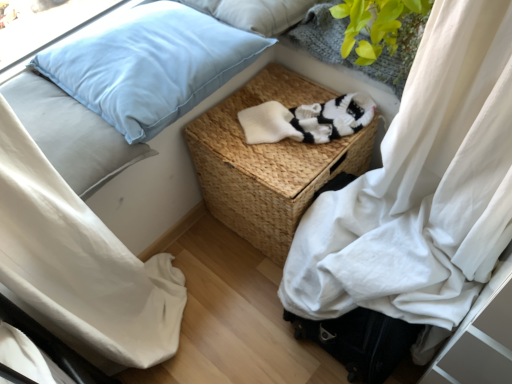
Locate an element on the screen. The image size is (512, 384). light blue fabric pillow at upper left, the 1th pillow from the top is located at coordinates (255, 13).

Describe the element at coordinates (255, 13) in the screenshot. I see `light blue fabric pillow at upper left, the 1th pillow from the top` at that location.

How much space does light blue fabric pillow at upper left, positioned as the second pillow in top-to-bottom order, occupy horizontally?

It is 19.73 inches.

Measure the distance between green knitted plant at upper right and camera.

The distance of green knitted plant at upper right from camera is 35.24 inches.

This screenshot has width=512, height=384. Describe the element at coordinates (268, 162) in the screenshot. I see `woven brown basket at center` at that location.

At what (x,y) coordinates should I click in order to perform the action: click on light blue fabric pillow at upper left, the third pillow from the bottom. Please return your answer as a coordinate pair (x, y). This screenshot has height=384, width=512. Looking at the image, I should click on (255, 13).

Based on the photo, considering the positions of objects light blue fabric pillow at upper left, acting as the 1th pillow starting from the bottom, and light blue fabric pillow at upper left, the 1th pillow from the top, in the image provided, who is more to the right, light blue fabric pillow at upper left, acting as the 1th pillow starting from the bottom, or light blue fabric pillow at upper left, the 1th pillow from the top,?

From the viewer's perspective, light blue fabric pillow at upper left, the 1th pillow from the top, appears more on the right side.

Is light blue fabric pillow at upper left, acting as the 1th pillow starting from the bottom, closer to camera compared to light blue fabric pillow at upper left, the 1th pillow from the top?

Yes.

Is light blue fabric pillow at upper left, the third pillow from the bottom, surrounded by light blue fabric pillow at upper left, which ranks as the third pillow in top-to-bottom order?

No, light blue fabric pillow at upper left, the third pillow from the bottom, is not inside light blue fabric pillow at upper left, which ranks as the third pillow in top-to-bottom order.

How different are the orientations of light blue fabric pillow at upper left, positioned as the second pillow in top-to-bottom order, and green knitted plant at upper right in degrees?

85.3 degrees separate the facing orientations of light blue fabric pillow at upper left, positioned as the second pillow in top-to-bottom order, and green knitted plant at upper right.

From the picture: Between light blue fabric pillow at upper left, which is the second pillow from bottom to top, and green knitted plant at upper right, which one has smaller width?

green knitted plant at upper right is thinner.

From the image's perspective, would you say light blue fabric pillow at upper left, positioned as the second pillow in top-to-bottom order, is positioned over green knitted plant at upper right?

No, from the image's perspective, light blue fabric pillow at upper left, positioned as the second pillow in top-to-bottom order, is not above green knitted plant at upper right.

Is light blue fabric pillow at upper left, which is the second pillow from bottom to top, bigger or smaller than green knitted plant at upper right?

light blue fabric pillow at upper left, which is the second pillow from bottom to top, is bigger than green knitted plant at upper right.

Is woven brown basket at center not close to white knitted socks at center?

woven brown basket at center is near white knitted socks at center, not far away.

Is woven brown basket at center bigger than white knitted socks at center?

Yes.

Is woven brown basket at center facing towards white knitted socks at center?

No, woven brown basket at center is not turned towards white knitted socks at center.

Considering the relative positions of woven brown basket at center and white knitted socks at center in the image provided, is woven brown basket at center to the left or to the right of white knitted socks at center?

Based on their positions, woven brown basket at center is located to the left of white knitted socks at center.

Does light blue fabric pillow at upper left, which is the second pillow from bottom to top, have a lesser height compared to woven brown basket at center?

Yes, light blue fabric pillow at upper left, which is the second pillow from bottom to top, is shorter than woven brown basket at center.

From the image's perspective, is light blue fabric pillow at upper left, which is the second pillow from bottom to top, located above or below woven brown basket at center?

From the image's perspective, light blue fabric pillow at upper left, which is the second pillow from bottom to top, appears above woven brown basket at center.

Where is `furniture on the right of light blue fabric pillow at upper left, positioned as the second pillow in top-to-bottom order`? furniture on the right of light blue fabric pillow at upper left, positioned as the second pillow in top-to-bottom order is located at coordinates (268, 162).

Find the location of `pillow that is the 3rd one when counting leftward from the green knitted plant at upper right`. pillow that is the 3rd one when counting leftward from the green knitted plant at upper right is located at coordinates (71, 133).

Considering the points (345, 55) and (78, 174), which point is in front, point (345, 55) or point (78, 174)?

Positioned in front is point (78, 174).

Is green knitted plant at upper right surrounding light blue fabric pillow at upper left, acting as the 1th pillow starting from the bottom?

No, light blue fabric pillow at upper left, acting as the 1th pillow starting from the bottom, is not inside green knitted plant at upper right.

Is light blue fabric pillow at upper left, acting as the 1th pillow starting from the bottom, at the back of green knitted plant at upper right?

No.

You are a GUI agent. You are given a task and a screenshot of the screen. Output one action in this format:
    pyautogui.click(x=<x>, y=<y>)
    Task: Click on the 2nd pillow counting from the right side of the light blue fabric pillow at upper left, acting as the 1th pillow starting from the bottom
    
    Given the screenshot: What is the action you would take?
    pyautogui.click(x=255, y=13)

Can you confirm if light blue fabric pillow at upper left, the 1th pillow from the top, is thinner than light blue fabric pillow at upper left, which ranks as the third pillow in top-to-bottom order?

Yes, light blue fabric pillow at upper left, the 1th pillow from the top, is thinner than light blue fabric pillow at upper left, which ranks as the third pillow in top-to-bottom order.

Which object is closer to the camera taking this photo, light blue fabric pillow at upper left, the third pillow from the bottom, or light blue fabric pillow at upper left, which ranks as the third pillow in top-to-bottom order?

Positioned in front is light blue fabric pillow at upper left, which ranks as the third pillow in top-to-bottom order.

Is light blue fabric pillow at upper left, the third pillow from the bottom, oriented away from light blue fabric pillow at upper left, which ranks as the third pillow in top-to-bottom order?

That's not correct — light blue fabric pillow at upper left, the third pillow from the bottom, is not looking away from light blue fabric pillow at upper left, which ranks as the third pillow in top-to-bottom order.

Between point (328, 133) and point (272, 69), which one is positioned in front?

Positioned in front is point (328, 133).

Is white knitted socks at center located outside woven brown basket at center?

Actually, white knitted socks at center is within woven brown basket at center.

Does white knitted socks at center appear on the right side of woven brown basket at center?

Correct, you'll find white knitted socks at center to the right of woven brown basket at center.

Which pillow is the 2nd one when counting from the back of the light blue fabric pillow at upper left, acting as the 1th pillow starting from the bottom? Please provide its 2D coordinates.

[(255, 13)]

Which pillow is the 2nd one when counting from the left side of the green knitted plant at upper right? Please provide its 2D coordinates.

[(150, 66)]

Which object lies nearer to the anchor point green knitted plant at upper right, white knitted socks at center or light blue fabric pillow at upper left, which is the second pillow from bottom to top?

Based on the image, white knitted socks at center appears to be nearer to green knitted plant at upper right.

Consider the image. When comparing their distances from light blue fabric pillow at upper left, which ranks as the third pillow in top-to-bottom order, does woven brown basket at center or light blue fabric pillow at upper left, the 1th pillow from the top, seem further?

light blue fabric pillow at upper left, the 1th pillow from the top, is further to light blue fabric pillow at upper left, which ranks as the third pillow in top-to-bottom order.

Estimate the real-world distances between objects in this image. Which object is closer to white knitted socks at center, light blue fabric pillow at upper left, the 1th pillow from the top, or green knitted plant at upper right?

green knitted plant at upper right is positioned closer to the anchor white knitted socks at center.

Estimate the real-world distances between objects in this image. Which object is closer to green knitted plant at upper right, light blue fabric pillow at upper left, acting as the 1th pillow starting from the bottom, or woven brown basket at center?

Based on the image, woven brown basket at center appears to be nearer to green knitted plant at upper right.

Based on their spatial positions, is light blue fabric pillow at upper left, which ranks as the third pillow in top-to-bottom order, or white knitted socks at center closer to light blue fabric pillow at upper left, positioned as the second pillow in top-to-bottom order?

The object closer to light blue fabric pillow at upper left, positioned as the second pillow in top-to-bottom order, is light blue fabric pillow at upper left, which ranks as the third pillow in top-to-bottom order.

Which object lies nearer to the anchor point light blue fabric pillow at upper left, the third pillow from the bottom, white knitted socks at center or light blue fabric pillow at upper left, which is the second pillow from bottom to top?

light blue fabric pillow at upper left, which is the second pillow from bottom to top, is positioned closer to the anchor light blue fabric pillow at upper left, the third pillow from the bottom.

When comparing their distances from light blue fabric pillow at upper left, positioned as the second pillow in top-to-bottom order, does light blue fabric pillow at upper left, the 1th pillow from the top, or woven brown basket at center seem further?

woven brown basket at center.

Consider the image. Which object lies nearer to the anchor point white knitted socks at center, green knitted plant at upper right or light blue fabric pillow at upper left, the 1th pillow from the top?

Among the two, green knitted plant at upper right is located nearer to white knitted socks at center.

At what (x,y) coordinates should I click in order to perform the action: click on clothing between light blue fabric pillow at upper left, acting as the 1th pillow starting from the bottom, and green knitted plant at upper right, in the horizontal direction. Please return your answer as a coordinate pair (x, y). Looking at the image, I should click on (307, 120).

Identify the location of furniture between light blue fabric pillow at upper left, acting as the 1th pillow starting from the bottom, and white knitted socks at center, in the horizontal direction. (268, 162).

Find the location of a particular element. Image resolution: width=512 pixels, height=384 pixels. pillow located between light blue fabric pillow at upper left, positioned as the second pillow in top-to-bottom order, and green knitted plant at upper right in the left-right direction is located at coordinates [x=255, y=13].

This screenshot has height=384, width=512. I want to click on pillow between light blue fabric pillow at upper left, the third pillow from the bottom, and light blue fabric pillow at upper left, which ranks as the third pillow in top-to-bottom order, from top to bottom, so click(150, 66).